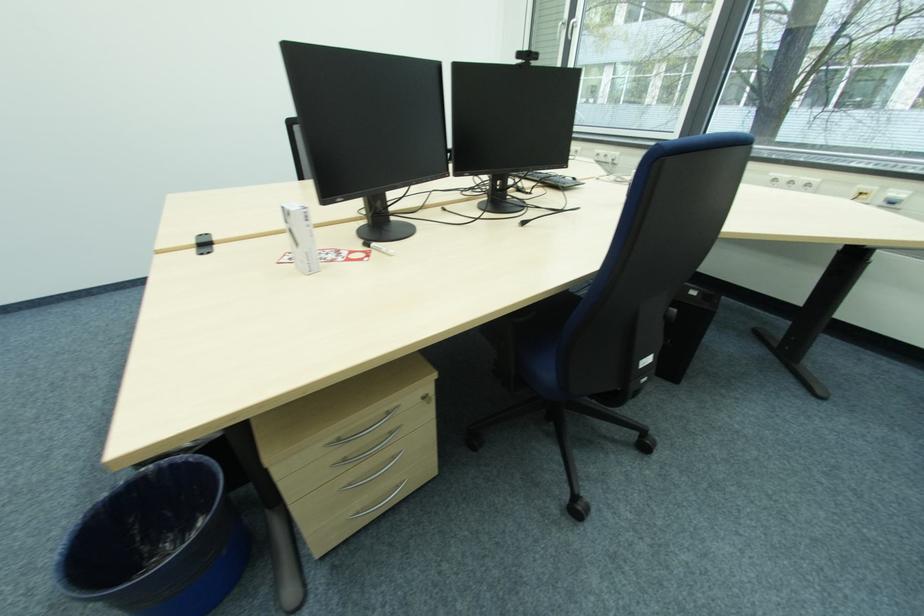
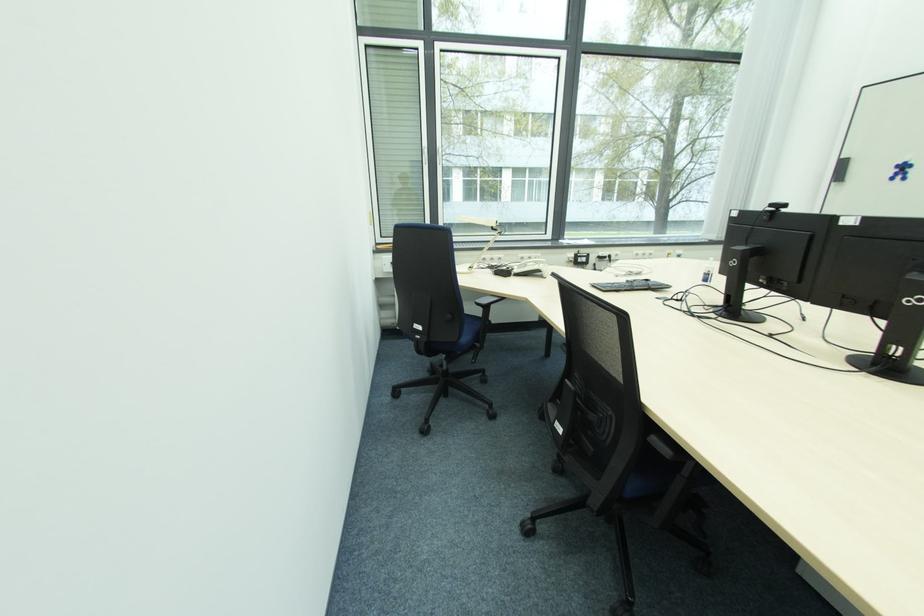
Question: I am providing you with two images of the same scene from different viewpoints. Please identify which objects are invisible in image2.

Choices:
 (A) white desk lamp
 (B) telephone handset
 (C) black keyboard
 (D) none of these

Answer: (D)